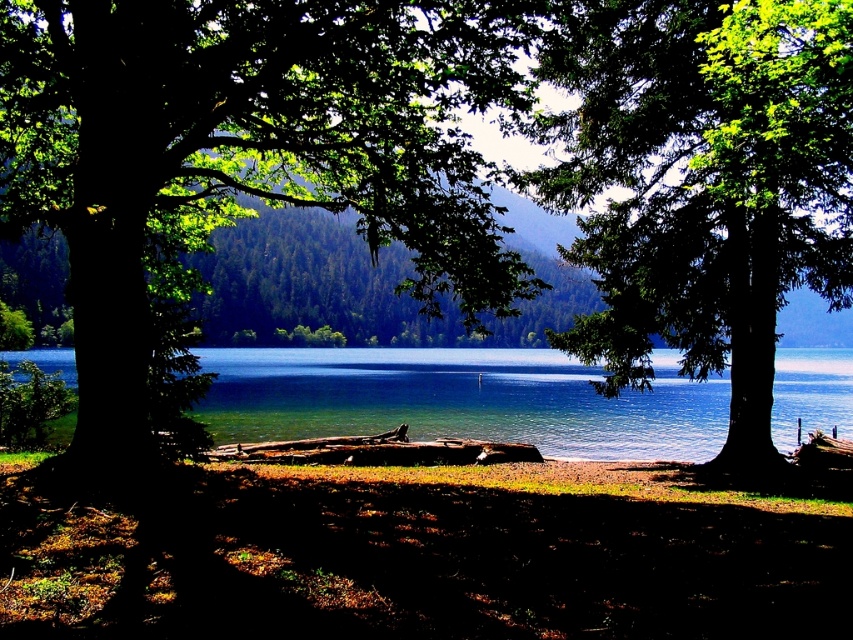
Question: Which of the following is the closest to the observer?

Choices:
 (A) (314, 424)
 (B) (83, 35)
 (C) (679, 145)

Answer: (B)

Question: Which point appears farthest from the camera in this image?

Choices:
 (A) (613, 420)
 (B) (457, 52)
 (C) (181, 516)
 (D) (659, 177)

Answer: (A)

Question: Is green leafy tree at center below clear blue water at center?

Choices:
 (A) no
 (B) yes

Answer: (A)

Question: Considering the relative positions of brown dirt at lower center and green leafy tree at center in the image provided, where is brown dirt at lower center located with respect to green leafy tree at center?

Choices:
 (A) above
 (B) below

Answer: (B)

Question: Which of the following is the farthest from the observer?

Choices:
 (A) (567, 397)
 (B) (416, 294)

Answer: (A)

Question: Where is green leafy tree at center located in relation to clear blue water at center in the image?

Choices:
 (A) below
 (B) above

Answer: (B)